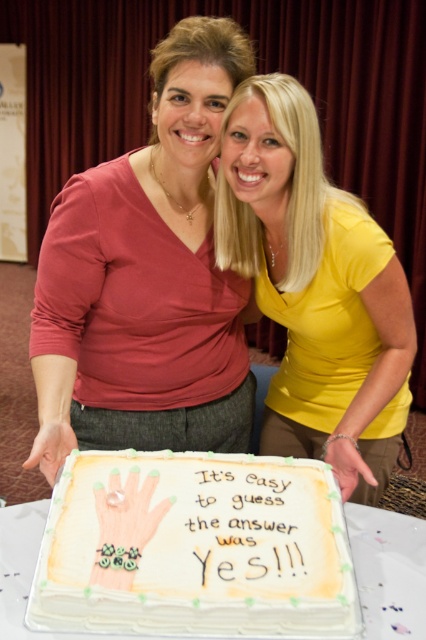
You are a photographer taking a picture of the matte red blouse at center and the ivory fondant cake at center. Based on their heights, which one should you focus on first if you want to ensure both are in frame without cropping?

The matte red blouse at center is taller than the ivory fondant cake at center, so you should focus on the matte red blouse at center first to ensure both fit in the frame without cropping.

You are a photographer taking a picture of the matte red blouse at center and the yellow matte shirt at center. The camera has a minimum focus distance of 8 inches. Can you take a clear photo of both items without moving them?

The matte red blouse at center and yellow matte shirt at center are 8.32 inches apart, so yes, the camera can focus on both since the distance between them is within the minimum focus distance of 8 inches.